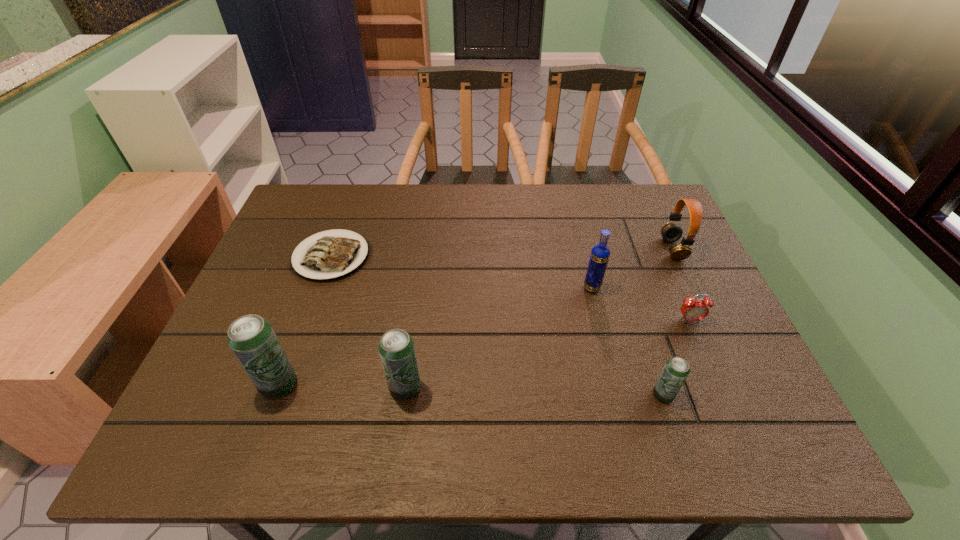
Please mark a free spot for a new beer_can to balance the arrangement. Please provide its 2D coordinates. Your answer should be formatted as a tuple, i.e. [(x, y)], where the tuple contains the x and y coordinates of a point satisfying the conditions above.

[(534, 391)]